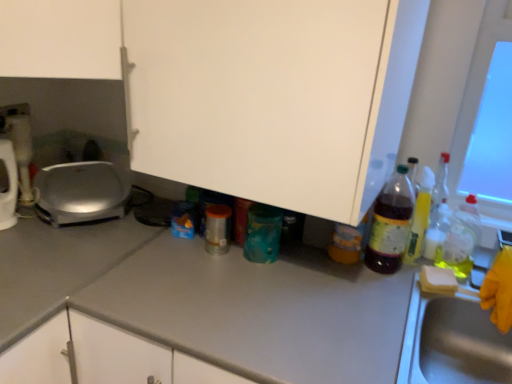
Locate an element on the screen. This screenshot has height=384, width=512. vacant space that is to the left of teal matte canister at center, positioned as the 2th bottle in left-to-right order is located at coordinates (196, 256).